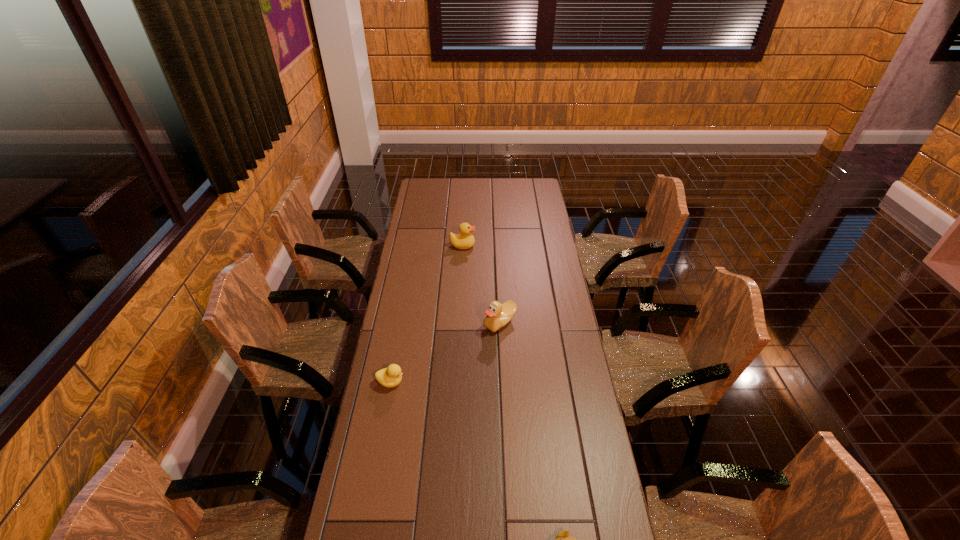
Locate an element on the screen. This screenshot has height=540, width=960. free location located on the front-facing side of the leftmost duck is located at coordinates (468, 382).

Where is `object that is at the left edge`? The image size is (960, 540). object that is at the left edge is located at coordinates (391, 376).

In the image, there is a desktop. Where is `vacant space at the far edge`? The height and width of the screenshot is (540, 960). vacant space at the far edge is located at coordinates (490, 192).

Where is `free location at the left edge of the desktop`? free location at the left edge of the desktop is located at coordinates (406, 256).

Locate an element on the screen. This screenshot has width=960, height=540. free spot at the right edge of the desktop is located at coordinates (584, 438).

You are a GUI agent. You are given a task and a screenshot of the screen. Output one action in this format:
    pyautogui.click(x=<x>, y=<y>)
    Task: Click on the vacant space at the far left corner of the desktop
    This screenshot has width=960, height=540.
    Given the screenshot: What is the action you would take?
    pyautogui.click(x=430, y=191)

In order to click on free point between the third nearest object and the nearest duck in this screenshot , I will do `click(445, 353)`.

This screenshot has width=960, height=540. In order to click on vacant space that's between the farthest duck and the shortest duck in this screenshot , I will do `click(426, 314)`.

Identify the location of free space between the third object from right to left and the third nearest object. Image resolution: width=960 pixels, height=540 pixels. 481,284.

Identify the location of free area in between the farthest duck and the rightmost duck. (x=481, y=284).